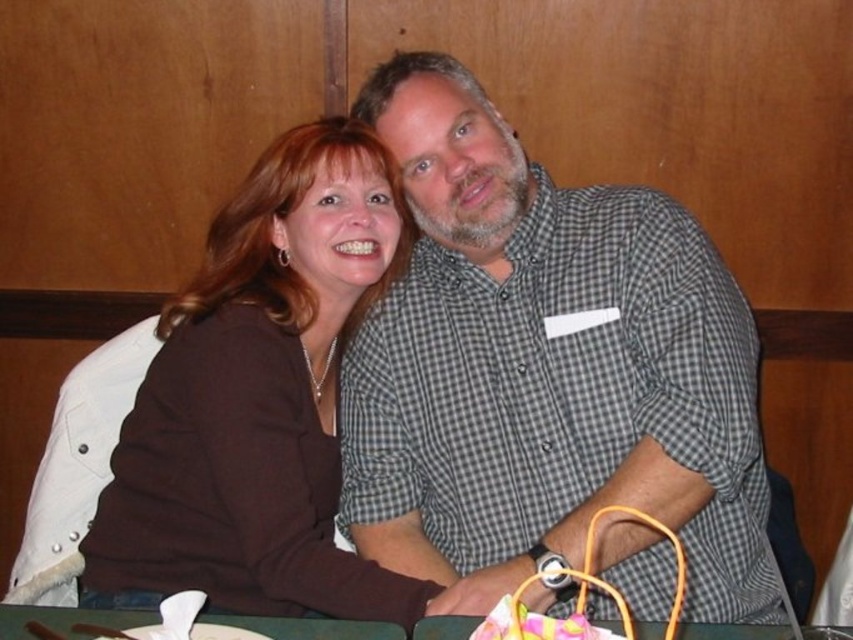
Does brown matte sweater at center have a lesser height compared to green fabric table at lower center?

In fact, brown matte sweater at center may be taller than green fabric table at lower center.

Does point (329, 474) lie in front of point (134, 621)?

No, it is not.

Identify the location of brown matte sweater at center. (259, 397).

Find the location of a particular element. This screenshot has height=640, width=853. brown matte sweater at center is located at coordinates (259, 397).

Is gray checkered shirt at center to the right of green fabric table at lower center from the viewer's perspective?

Correct, you'll find gray checkered shirt at center to the right of green fabric table at lower center.

Is point (445, 307) positioned behind point (637, 628)?

Yes, it is behind point (637, 628).

The width and height of the screenshot is (853, 640). I want to click on gray checkered shirt at center, so click(x=544, y=369).

Looking at this image, can you confirm if gray checkered shirt at center is positioned to the left of brown matte sweater at center?

No, gray checkered shirt at center is not to the left of brown matte sweater at center.

In the scene shown: Does gray checkered shirt at center come behind brown matte sweater at center?

Yes, gray checkered shirt at center is behind brown matte sweater at center.

Is point (502, 164) closer to viewer compared to point (305, 445)?

That is False.

I want to click on gray checkered shirt at center, so click(544, 369).